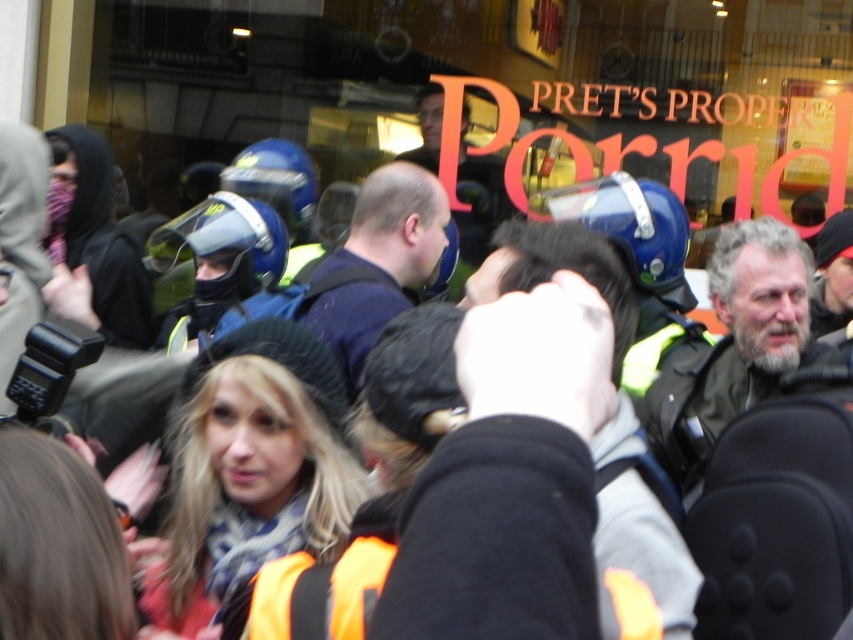
Question: Which object appears farthest from the camera in this image?

Choices:
 (A) gray beard at center
 (B) dark blue shirt at center

Answer: (B)

Question: Can you confirm if gray beard at center is wider than dark blue shirt at center?

Choices:
 (A) yes
 (B) no

Answer: (A)

Question: Does gray beard at center have a smaller size compared to dark blue shirt at center?

Choices:
 (A) yes
 (B) no

Answer: (A)

Question: In this image, where is gray beard at center located relative to dark blue shirt at center?

Choices:
 (A) above
 (B) below

Answer: (B)

Question: Which point is closer to the camera?

Choices:
 (A) gray beard at center
 (B) dark blue shirt at center

Answer: (A)